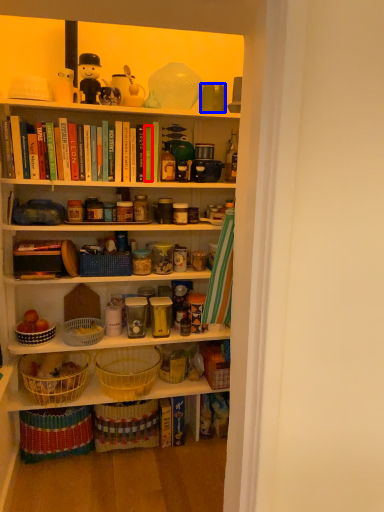
Question: Among these objects, which one is nearest to the camera, book (highlighted by a red box) or coffee cup (highlighted by a blue box)?

Choices:
 (A) book
 (B) coffee cup

Answer: (B)